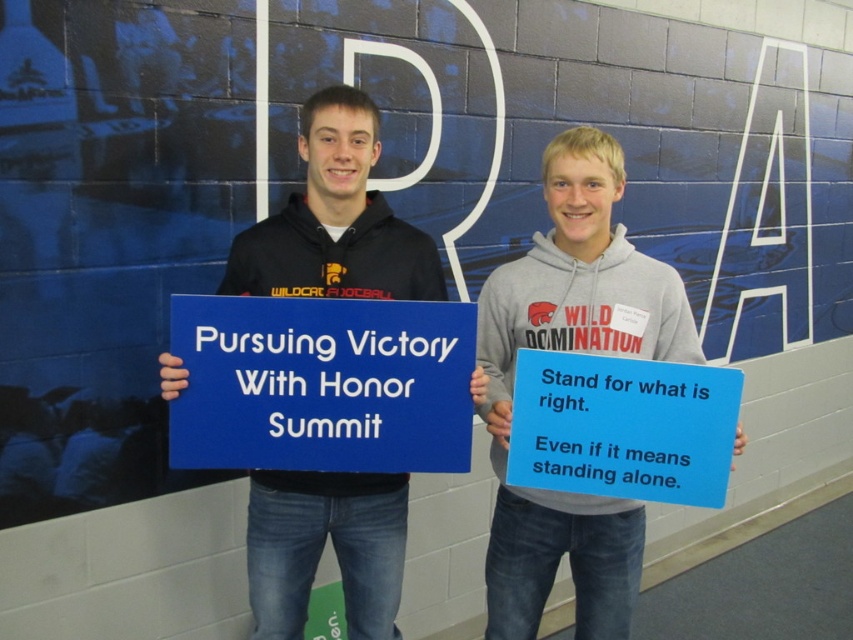
Which is below, gray hoodie at center or blue cardstock sign at center?

blue cardstock sign at center

Based on the photo, between gray hoodie at center and blue cardstock sign at center, which one appears on the left side from the viewer's perspective?

blue cardstock sign at center is more to the left.

Does point (519, 509) lie in front of point (515, 428)?

No, it is not.

This screenshot has width=853, height=640. Identify the location of gray hoodie at center. point(579,352).

Is point (540, 547) in front of point (445, 449)?

No, (540, 547) is further to viewer.

This screenshot has height=640, width=853. I want to click on gray hoodie at center, so click(579, 352).

The height and width of the screenshot is (640, 853). Describe the element at coordinates (321, 385) in the screenshot. I see `blue matte sign at center` at that location.

Between blue matte sign at center and matte black hoodie at center, which one appears on the right side from the viewer's perspective?

Positioned to the right is blue matte sign at center.

The height and width of the screenshot is (640, 853). In order to click on blue matte sign at center in this screenshot , I will do `click(321, 385)`.